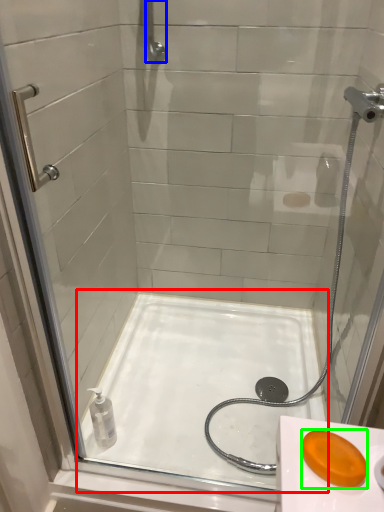
Question: Which object is the closest to the bath (highlighted by a red box)? Choose among these: shower (highlighted by a blue box) or soap (highlighted by a green box).

Choices:
 (A) shower
 (B) soap

Answer: (B)